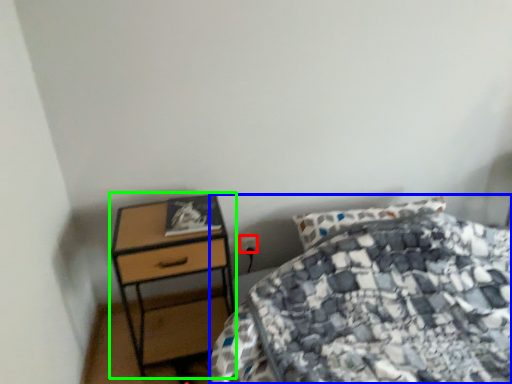
Question: Which object is positioned closest to power plugs and sockets (highlighted by a red box)? Select from bed (highlighted by a blue box) and nightstand (highlighted by a green box).

Choices:
 (A) bed
 (B) nightstand

Answer: (B)